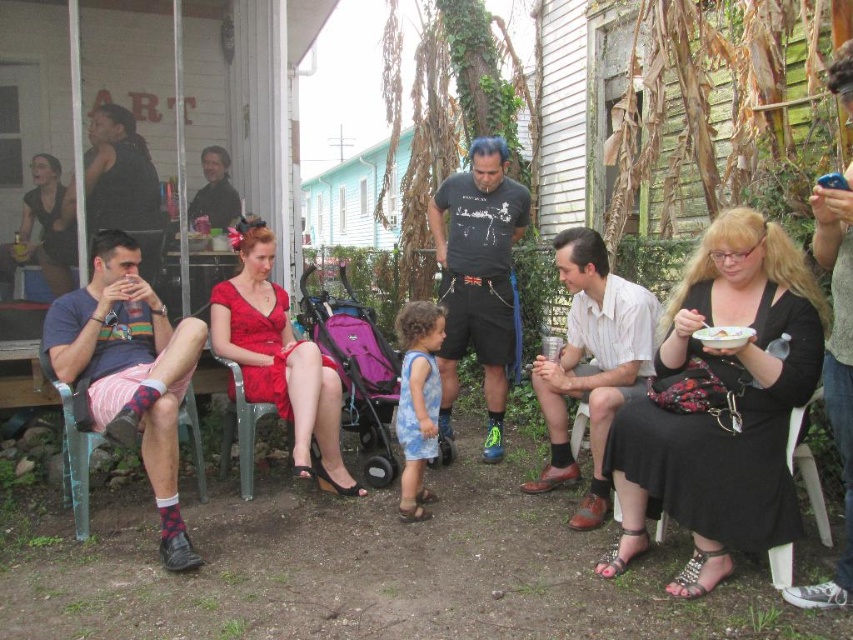
Based on the photo, you are standing at point (65, 410) and want to walk to point (775, 474). Which direction should you move in relation to the two points?

You should move forward towards point (775, 474), which is in front of point (65, 410).

You are standing at the point labeled as point (74, 445) in the image. What object is located at this point?

The metallic green chair at left is located at point (74, 445).

You are standing at the origin point in the image. The black satin dress at right is located at coordinates point (720,404). If you want to walk directly to the black satin dress at right, in which direction should you move?

The point (720,404) marks the location of the black satin dress at right. Since the coordinates are given as x,y, moving towards increasing x values would mean moving to the right. Therefore, to reach the black satin dress at right, you should move to the right.